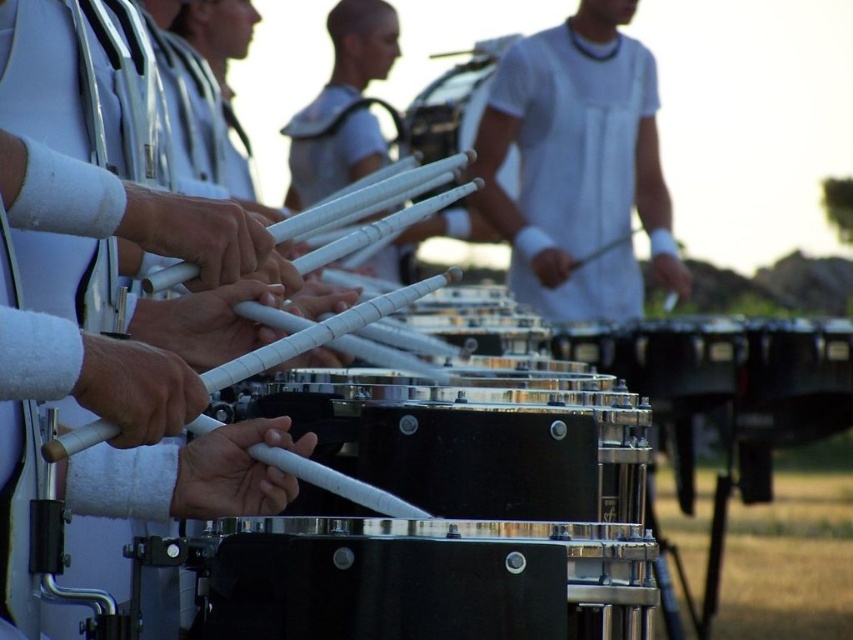
You are a photographer trying to capture a closeup shot of the black metallic drum at center and the black polished drum at center. Which drum should you focus on first to ensure the foreground object is sharp?

The black metallic drum at center is in front of the black polished drum at center, so you should focus on the black metallic drum at center first to ensure the foreground object is sharp.

You are a photographer trying to capture the drummer in the center. The camera you are using has a focus point at coordinate point 0.261, 0.679. Will the white matte shirt at center be in focus?

Yes, the white matte shirt at center is positioned exactly at point (578, 166), so it will be in focus.

You are a photographer standing at the edge of the performance area. You want to take a closeup photo of the white matte shirt at center and the black polished drum at center without any blur. Given that your camera has a depth of field that can sharply focus on objects within a 17 inch range, will both objects be in focus?

The white matte shirt at center and the black polished drum at center are 17.30 inches apart. Since the depth of field can only sharply focus within a 17 inch range, the distance between them exceeds this limit. Therefore, both objects cannot be in focus simultaneously.